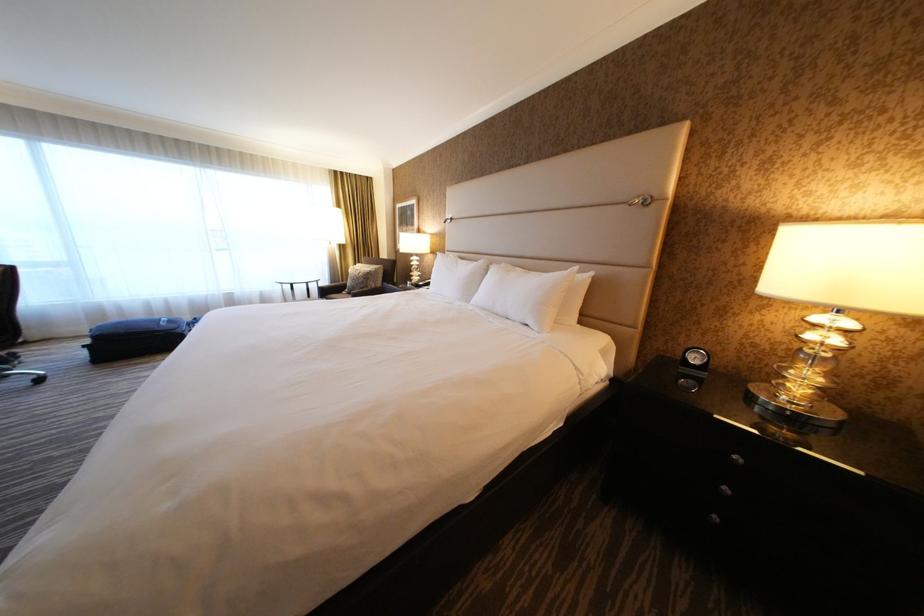
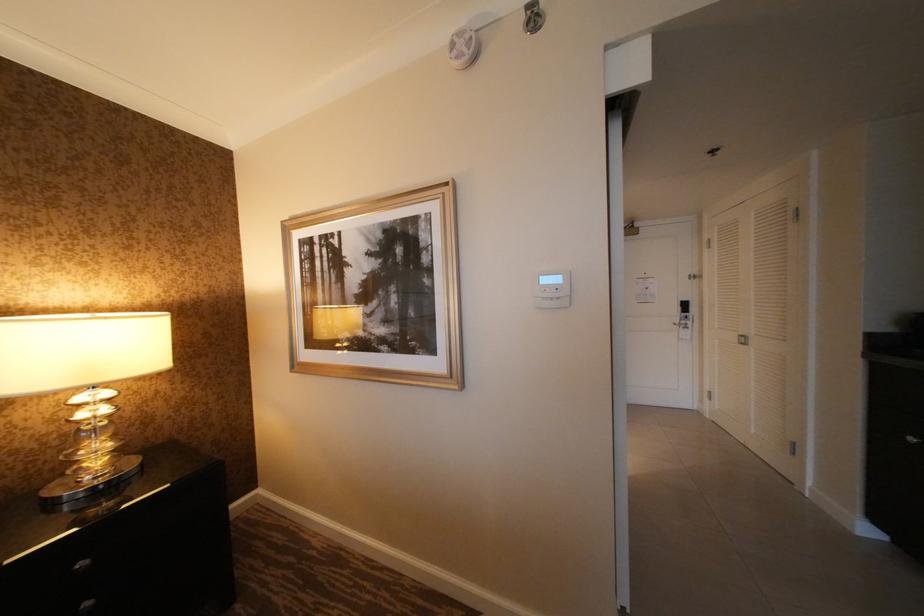
Question: The camera is either moving clockwise (left) or counter-clockwise (right) around the object. The first image is from the beginning of the video and the second image is from the end. Is the camera moving left or right when shooting the video?

Choices:
 (A) Left
 (B) Right

Answer: (A)